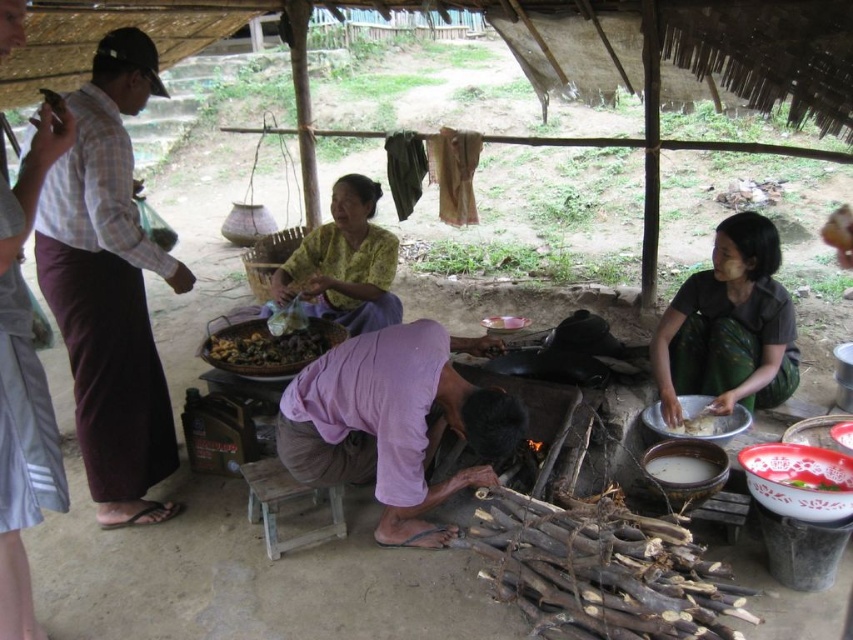
Question: Which object appears closest to the camera in this image?

Choices:
 (A) purple cotton shirt at center
 (B) green woven skirt at lower right

Answer: (A)

Question: Is yellow printed fabric at center smaller than white matte rice at lower right?

Choices:
 (A) yes
 (B) no

Answer: (B)

Question: Estimate the real-world distances between objects in this image. Which object is farther from the wooden stool at center?

Choices:
 (A) white matte rice bowl at center
 (B) plaid fabric shirt at left
 (C) green woven skirt at lower right

Answer: (A)

Question: Which point is farther from the camera taking this photo?

Choices:
 (A) (784, 472)
 (B) (312, 362)
 (C) (496, 330)

Answer: (C)

Question: Is yellow printed fabric at center further to the viewer compared to porcelain bowl at lower right?

Choices:
 (A) no
 (B) yes

Answer: (B)

Question: Is white glossy bowl at lower right above brown matte dried beans at center?

Choices:
 (A) yes
 (B) no

Answer: (B)